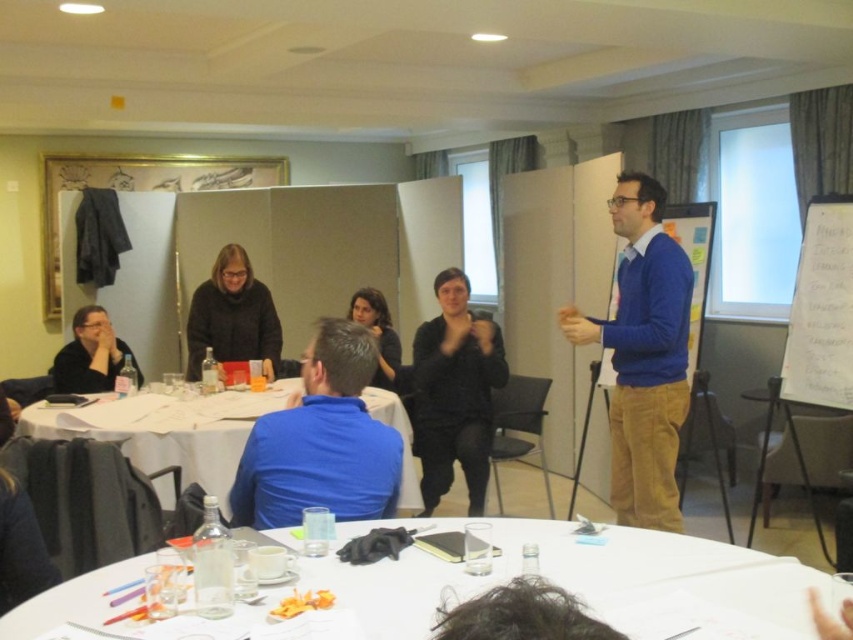
How much distance is there between white glossy table at center and white paper table at center?

A distance of 1.75 meters exists between white glossy table at center and white paper table at center.

Can you confirm if white glossy table at center is wider than white paper table at center?

No.

At what (x,y) coordinates should I click in order to perform the action: click on white glossy table at center. Please return your answer as a coordinate pair (x, y). Looking at the image, I should click on (577, 577).

Locate an element on the screen. The width and height of the screenshot is (853, 640). white glossy table at center is located at coordinates (577, 577).

Between white glossy table at center and blue matte shirt at center, which one appears on the left side from the viewer's perspective?

Positioned to the left is blue matte shirt at center.

Between white glossy table at center and blue matte shirt at center, which one is positioned higher?

Positioned higher is blue matte shirt at center.

Is point (93, 588) farther from camera compared to point (328, 440)?

No, (93, 588) is in front of (328, 440).

At what (x,y) coordinates should I click in order to perform the action: click on white glossy table at center. Please return your answer as a coordinate pair (x, y). Looking at the image, I should click on (577, 577).

Does blue corduroy sweater at center have a lesser width compared to blue matte shirt at center?

Yes.

Does blue corduroy sweater at center have a lesser height compared to blue matte shirt at center?

In fact, blue corduroy sweater at center may be taller than blue matte shirt at center.

Image resolution: width=853 pixels, height=640 pixels. I want to click on blue corduroy sweater at center, so click(x=643, y=355).